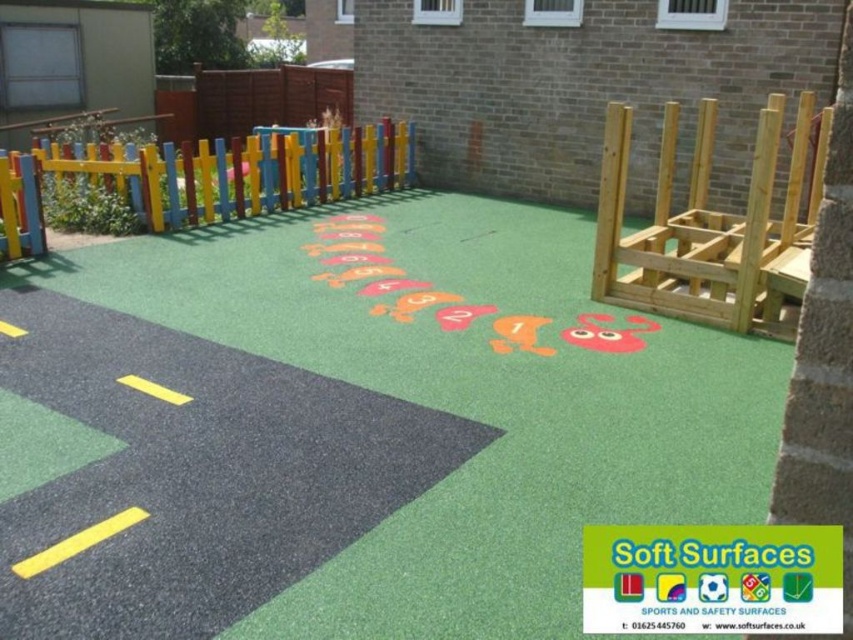
Is black asphalt road at lower left thinner than multicolored wooden fence at upper left?

Correct, black asphalt road at lower left's width is less than multicolored wooden fence at upper left's.

Find the location of a particular element. This screenshot has width=853, height=640. black asphalt road at lower left is located at coordinates (194, 474).

Does green rubberized playground surface at center have a greater width compared to black asphalt road at lower left?

Incorrect, green rubberized playground surface at center's width does not surpass black asphalt road at lower left's.

Which is above, green rubberized playground surface at center or black asphalt road at lower left?

black asphalt road at lower left is higher up.

Where is `green rubberized playground surface at center`? This screenshot has height=640, width=853. green rubberized playground surface at center is located at coordinates (351, 428).

In order to click on green rubberized playground surface at center in this screenshot , I will do `click(351, 428)`.

Is point (717, 417) more distant than point (370, 180)?

No, (717, 417) is closer to viewer.

Who is more forward, (25, 275) or (239, 148)?

Point (25, 275)

The image size is (853, 640). Describe the element at coordinates (351, 428) in the screenshot. I see `green rubberized playground surface at center` at that location.

Where is `green rubberized playground surface at center`? green rubberized playground surface at center is located at coordinates (351, 428).